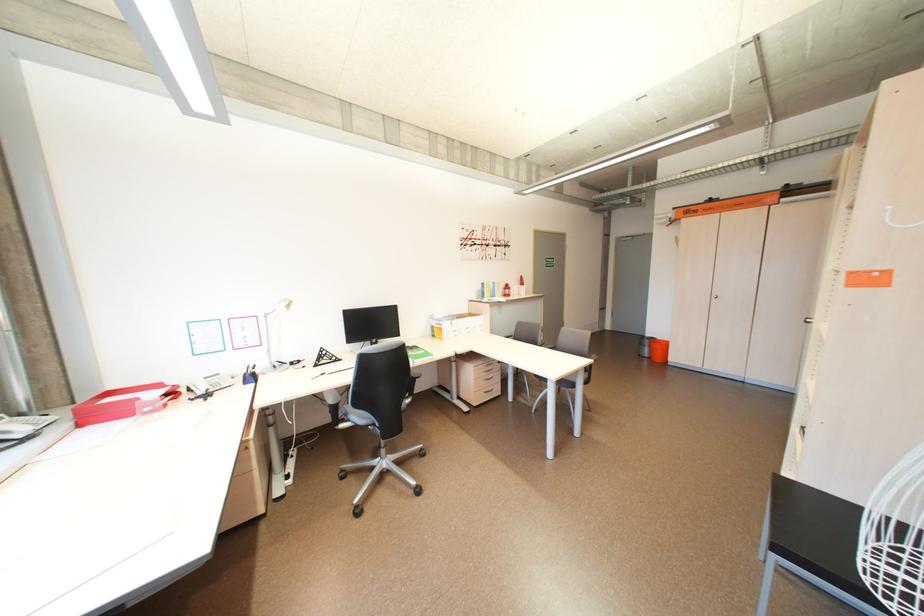
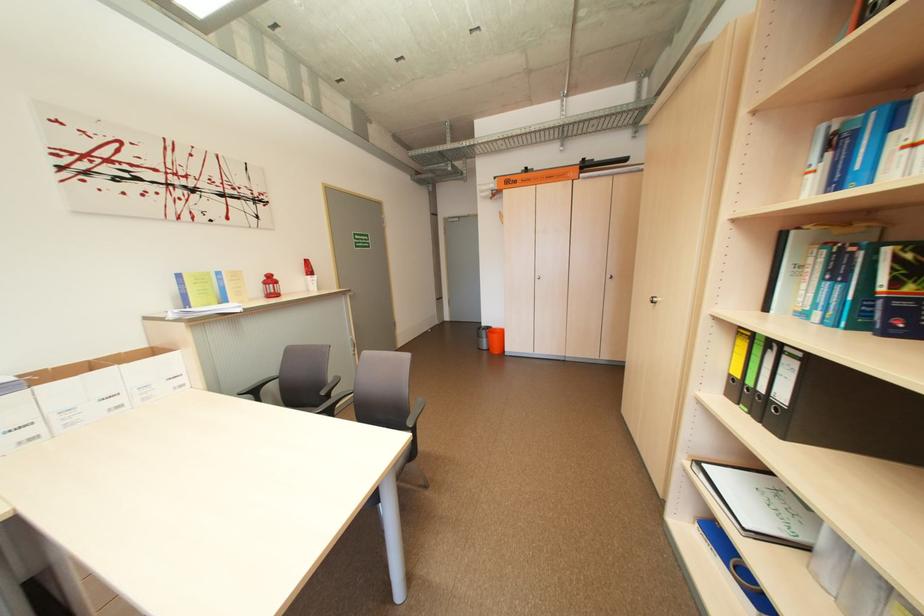
The point at (480,315) is marked in the first image. Where is the corresponding point in the second image?

(163, 353)